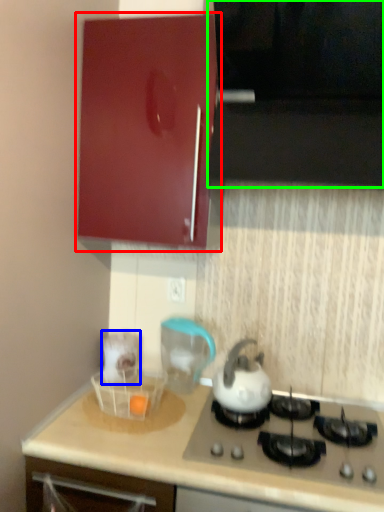
Question: Which object is positioned farthest from cabinetry (highlighted by a red box)? Select from appliance (highlighted by a blue box) and vent (highlighted by a green box).

Choices:
 (A) appliance
 (B) vent

Answer: (A)